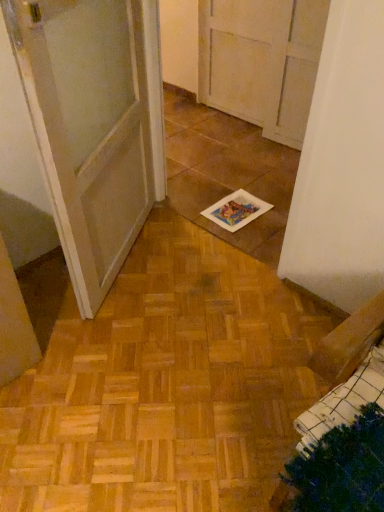
Question: Looking at their shapes, would you say white paper at center is wider or thinner than white glossy door at center?

Choices:
 (A) wide
 (B) thin

Answer: (A)

Question: Considering their positions, is white paper at center located in front of or behind white glossy door at center?

Choices:
 (A) front
 (B) behind

Answer: (B)

Question: In terms of height, does white paper at center look taller or shorter compared to white glossy door at center?

Choices:
 (A) tall
 (B) short

Answer: (B)

Question: From the image's perspective, is white glossy door at center located above or below white paper at center?

Choices:
 (A) above
 (B) below

Answer: (A)

Question: Is white glossy door at center to the left or to the right of white paper at center in the image?

Choices:
 (A) right
 (B) left

Answer: (B)

Question: Do you think white glossy door at center is within white paper at center, or outside of it?

Choices:
 (A) inside
 (B) outside

Answer: (B)

Question: Looking at their shapes, would you say white glossy door at center is wider or thinner than white paper at center?

Choices:
 (A) thin
 (B) wide

Answer: (A)